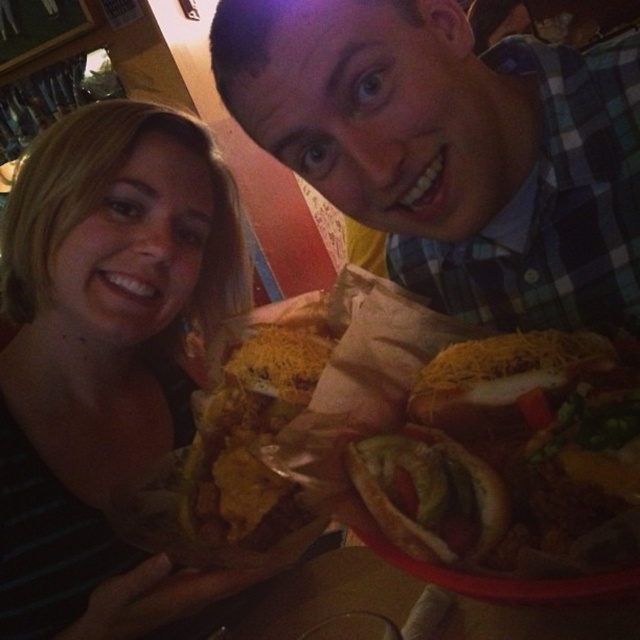
You are a photographer setting up for a group photo. You need to position the green plaid shirt at upper right and the matte black shirt at lower left so that they are exactly 12 inches apart. Based on the current arrangement shown in the image, should you move them closer together or farther apart?

The green plaid shirt at upper right and matte black shirt at lower left are currently 13.75 inches apart. Since 13.75 is greater than 12, you should move them closer together to achieve the desired distance.

You are taking a photo of the two people holding plates of food. Which point, point (337, 35) or point (148, 147), is closer to the camera?

Point (337, 35) is closer to the camera than point (148, 147).